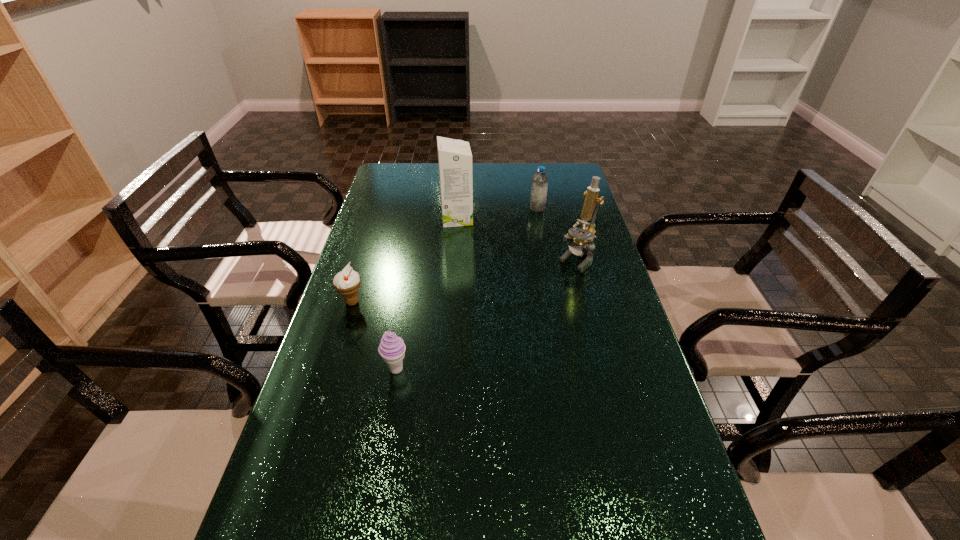
Where is `free location that satisfies the following two spatial constraints: 1. on the front side of the nearest object; 2. on the right side of the left icecream`? Image resolution: width=960 pixels, height=540 pixels. free location that satisfies the following two spatial constraints: 1. on the front side of the nearest object; 2. on the right side of the left icecream is located at coordinates (331, 369).

Image resolution: width=960 pixels, height=540 pixels. I want to click on vacant space that satisfies the following two spatial constraints: 1. on the back side of the nearer icecream; 2. on the left side of the third nearest object, so click(416, 259).

Where is `free space that satisfies the following two spatial constraints: 1. on the back side of the fourth farthest object; 2. on the right side of the carton`? This screenshot has width=960, height=540. free space that satisfies the following two spatial constraints: 1. on the back side of the fourth farthest object; 2. on the right side of the carton is located at coordinates tap(378, 219).